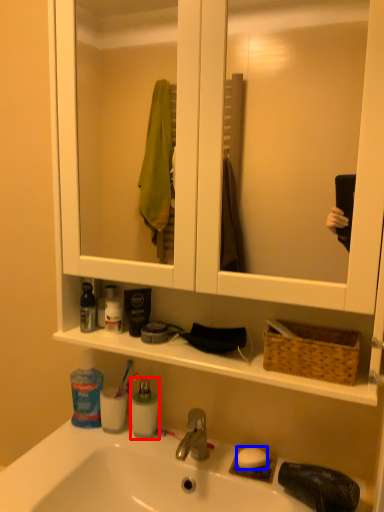
Question: Which of the following is the closest to the observer, mouthwash (highlighted by a red box) or soap (highlighted by a blue box)?

Choices:
 (A) mouthwash
 (B) soap

Answer: (B)